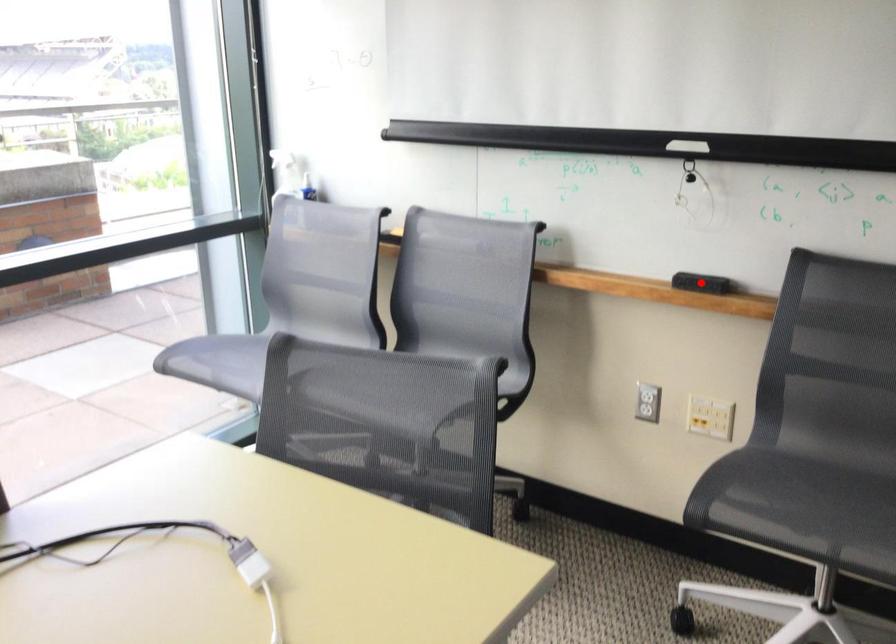
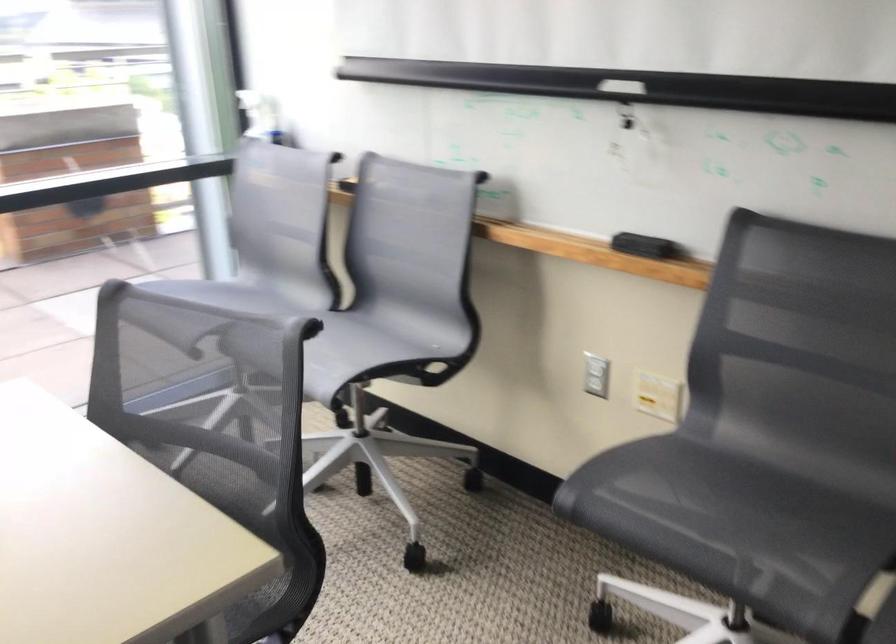
Question: I am providing you with two images of the same scene from different viewpoints. Given a red point in image1, look at the same physical point in image2. Is it:

Choices:
 (A) Closer to the viewpoint
 (B) Farther from the viewpoint

Answer: (A)